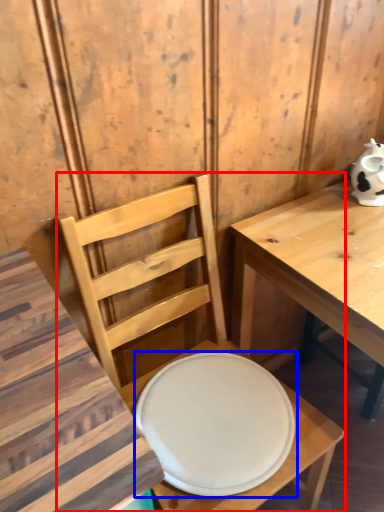
Question: Which point is closer to the camera, chair (highlighted by a red box) or plate (highlighted by a blue box)?

Choices:
 (A) chair
 (B) plate

Answer: (A)